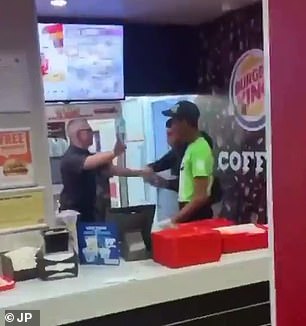
The image size is (306, 326). What are the coordinates of `counter` in the screenshot? It's located at tap(79, 280).